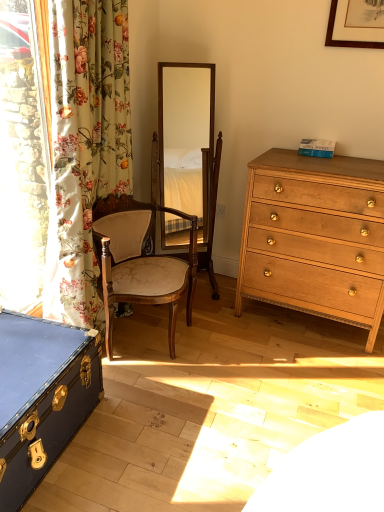
At what (x,y) coordinates should I click in order to perform the action: click on vacant space situated above blue leather trunk at lower left (from a real-world perspective). Please return your answer as a coordinate pair (x, y). The width and height of the screenshot is (384, 512). Looking at the image, I should click on (31, 354).